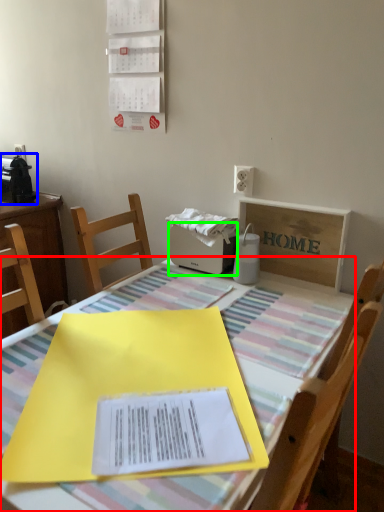
Question: Which object is positioned farthest from table (highlighted by a red box)? Select from appliance (highlighted by a blue box) and appliance (highlighted by a green box).

Choices:
 (A) appliance
 (B) appliance

Answer: (A)